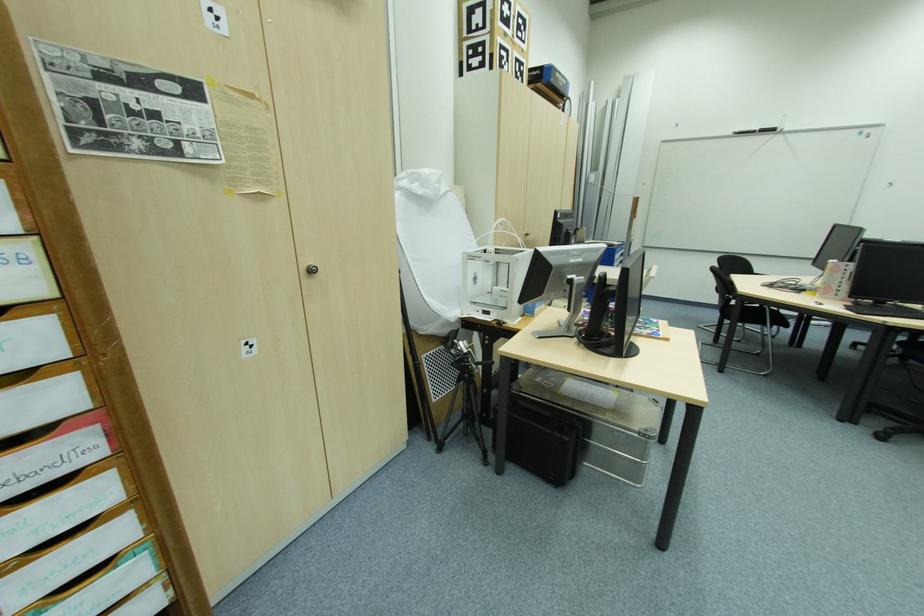
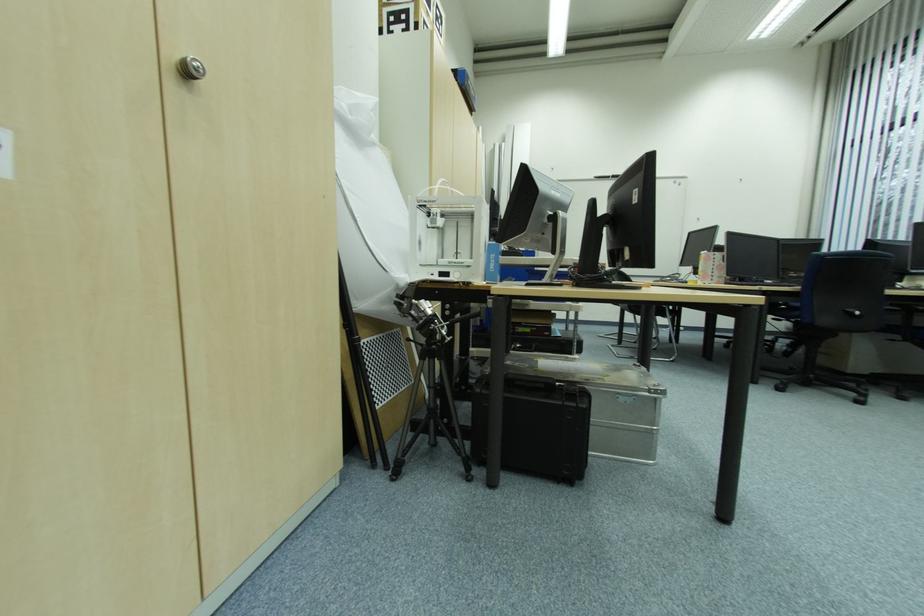
In a continuous first-person perspective shot, in which direction is the camera moving?

The movement direction of the cameraman is left, forward.